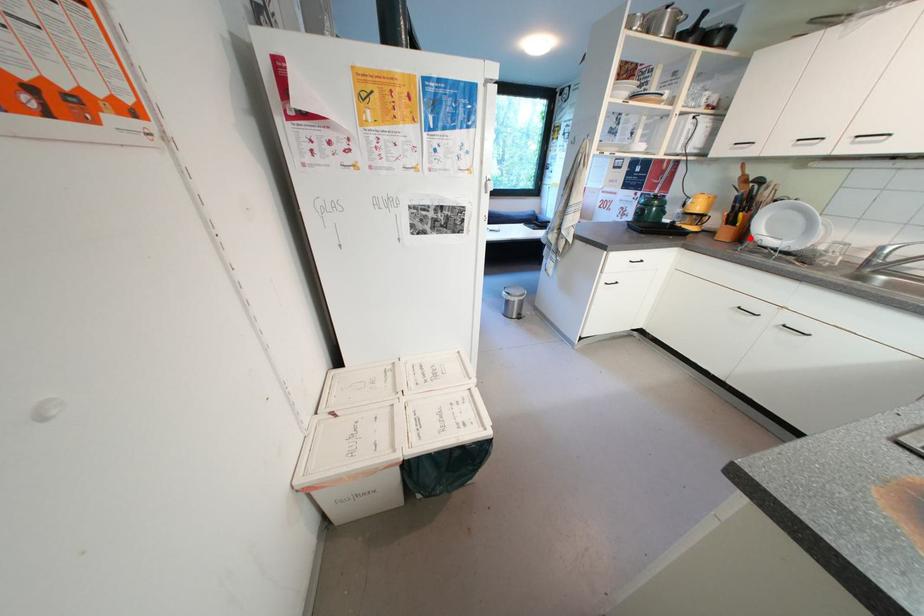
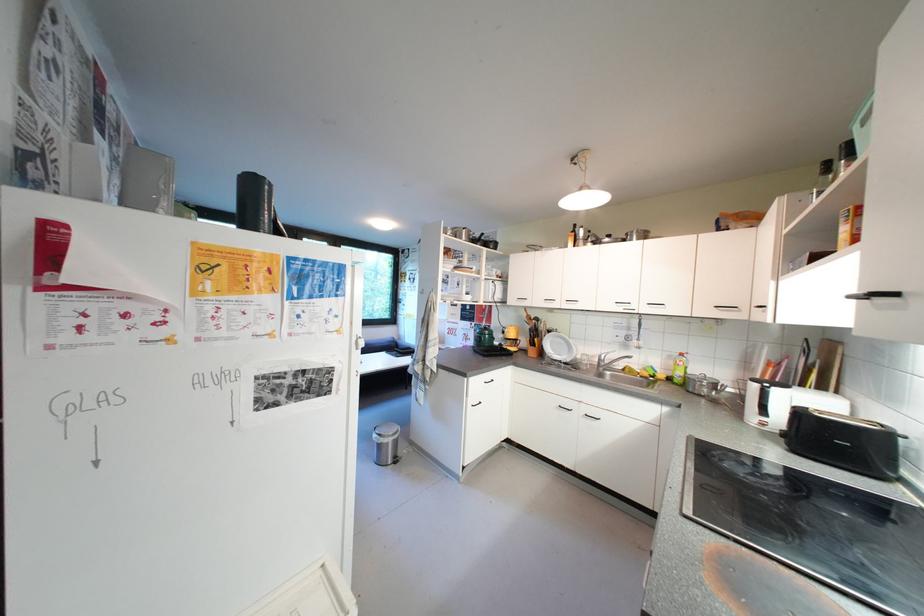
Where in the second image is the point corresponding to the highlighted location from the first image?

(550, 355)